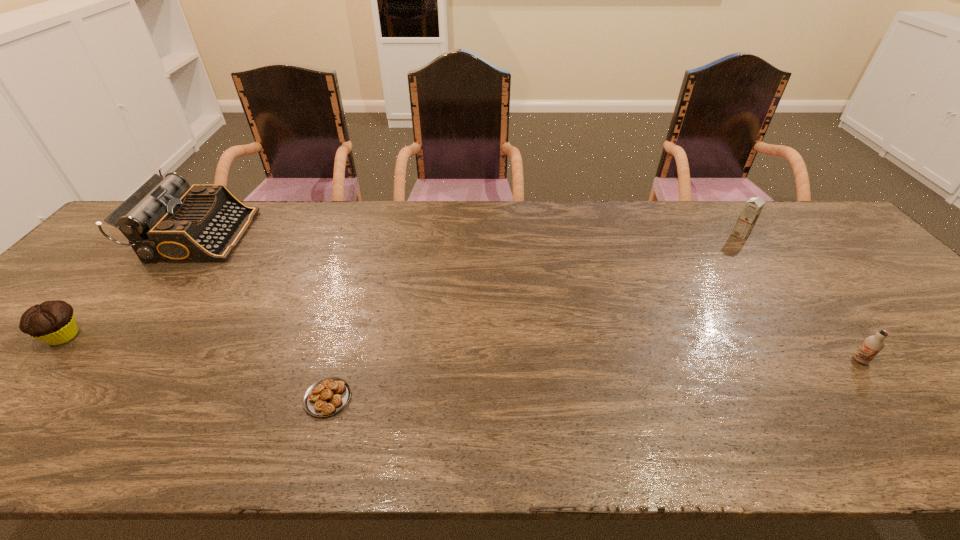
The width and height of the screenshot is (960, 540). What are the coordinates of `free region that satisfies the following two spatial constraints: 1. on the keyboard of the tallest object; 2. on the left side of the nearest object` in the screenshot? It's located at (72, 398).

Where is `free location that satisfies the following two spatial constraints: 1. on the back side of the nearer chocolate milk; 2. on the keyboard of the tallest object`? The image size is (960, 540). free location that satisfies the following two spatial constraints: 1. on the back side of the nearer chocolate milk; 2. on the keyboard of the tallest object is located at coordinates (761, 235).

The height and width of the screenshot is (540, 960). Find the location of `blank space that satisfies the following two spatial constraints: 1. on the front side of the farther chocolate milk; 2. on the keyboard of the typewriter`. blank space that satisfies the following two spatial constraints: 1. on the front side of the farther chocolate milk; 2. on the keyboard of the typewriter is located at coordinates (742, 235).